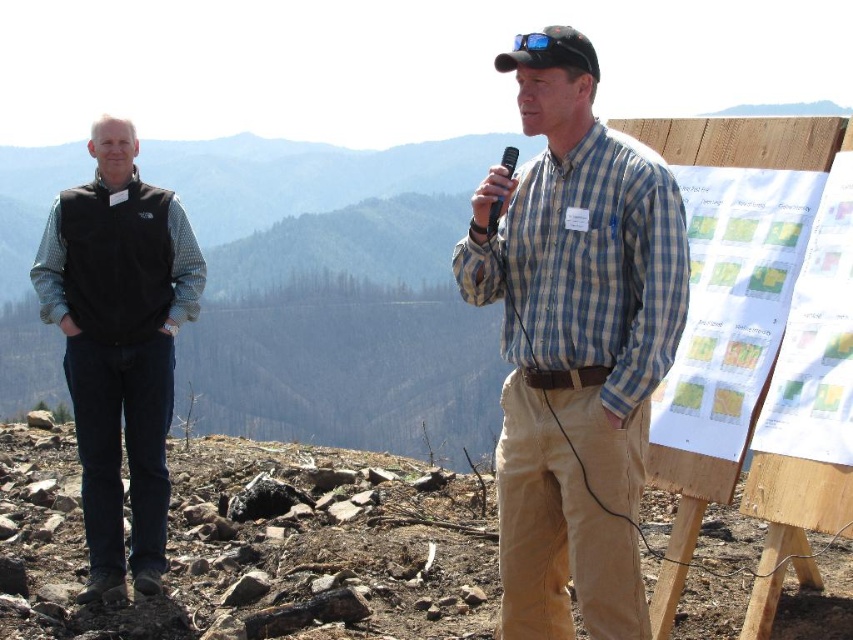
Who is positioned more to the right, blue plaid shirt at center or black fleece vest at left?

Positioned to the right is blue plaid shirt at center.

Between point (544, 164) and point (115, 573), which one is positioned in front?

Point (544, 164) is more forward.

The height and width of the screenshot is (640, 853). I want to click on blue plaid shirt at center, so click(x=575, y=340).

Where is `blue plaid shirt at center`? This screenshot has width=853, height=640. blue plaid shirt at center is located at coordinates (575, 340).